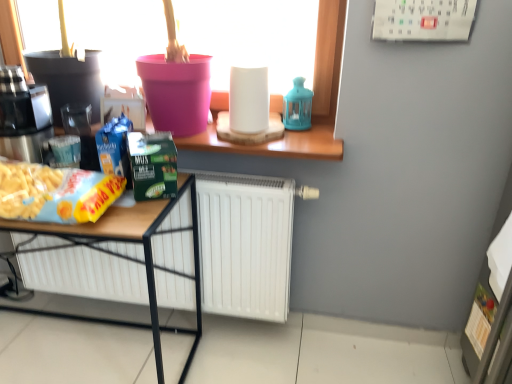
Question: Is yellow matte snack packet at lower left to the left or to the right of brushed metal coffee machine at left in the image?

Choices:
 (A) right
 (B) left

Answer: (A)

Question: Is yellow matte snack packet at lower left taller or shorter than brushed metal coffee machine at left?

Choices:
 (A) short
 (B) tall

Answer: (A)

Question: Estimate the real-world distances between objects in this image. Which object is closer to the wooden desk at lower left?

Choices:
 (A) brushed metal coffee machine at left
 (B) pink plastic bucket at upper center
 (C) yellow matte snack packet at lower left

Answer: (C)

Question: Which of these objects is positioned closest to the yellow matte snack packet at lower left?

Choices:
 (A) pink plastic bucket at upper center
 (B) brushed metal coffee machine at left
 (C) wooden desk at lower left

Answer: (C)